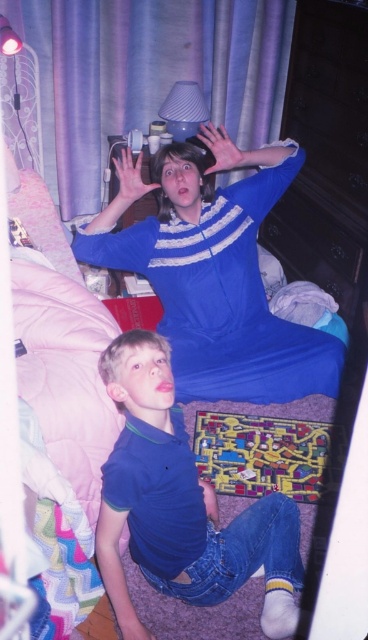
You are a photographer setting up a shoot in this bedroom. You have two props to place in the scene. The blue smooth dress at upper center and the purple fabric curtain at upper center. Since you want to ensure that both props are visible in the frame, which prop should you place closer to the camera to avoid it being obscured by the other?

The blue smooth dress at upper center is not as tall as the purple fabric curtain at upper center. To ensure both are visible, place the shorter blue smooth dress at upper center closer to the camera so it isn

You are organizing a photoshoot in the bedroom scene and need to ensure the blue cotton shirt at lower left is visible. Is the purple fabric curtain at upper center blocking it?

The purple fabric curtain at upper center is positioned over the blue cotton shirt at lower left, so it is blocking the shirt.

You are standing in the bedroom and want to move from point A to point B. Point A is at coordinate point (266,10) and point B is at coordinate point (179,93). Since you can only move forward, will you have to go around any obstacles between these two points?

Point A at coordinate point (266,10) is closer to you than point B at coordinate point (179,93). Therefore, moving from point A to point B would require moving away from you, so you don not need to go around any obstacles between these two points.